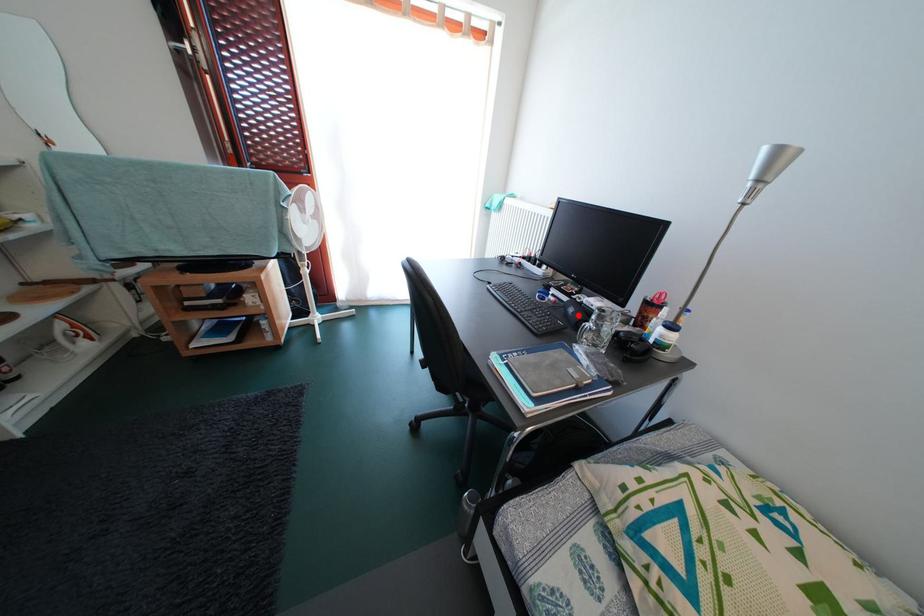
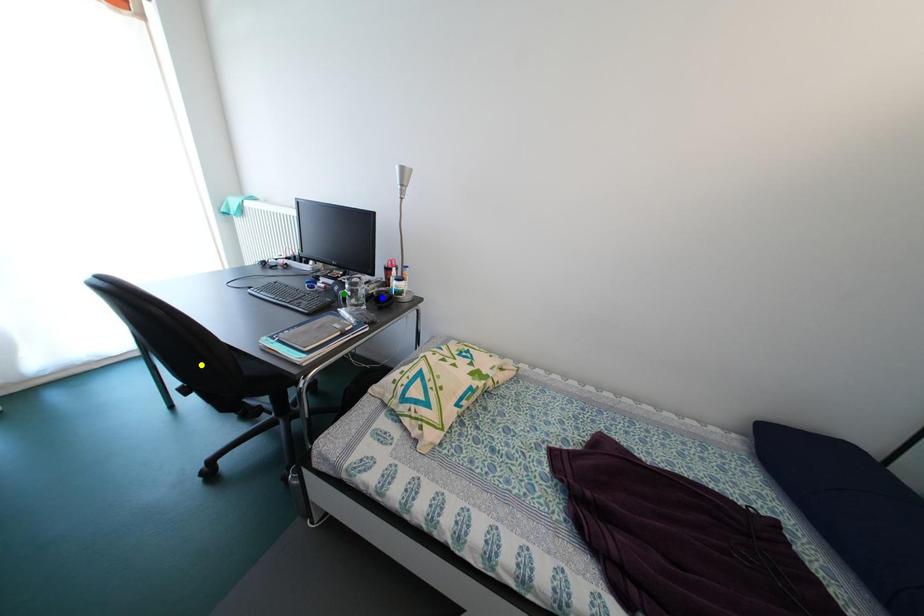
Question: I am providing you with two images of the same scene from different viewpoints. A red point is marked on the first image. You are given multiple points on the second image. Which spot in image 2 lines up with the point in image 1?

Choices:
 (A) green point
 (B) blue point
 (C) yellow point

Answer: (A)